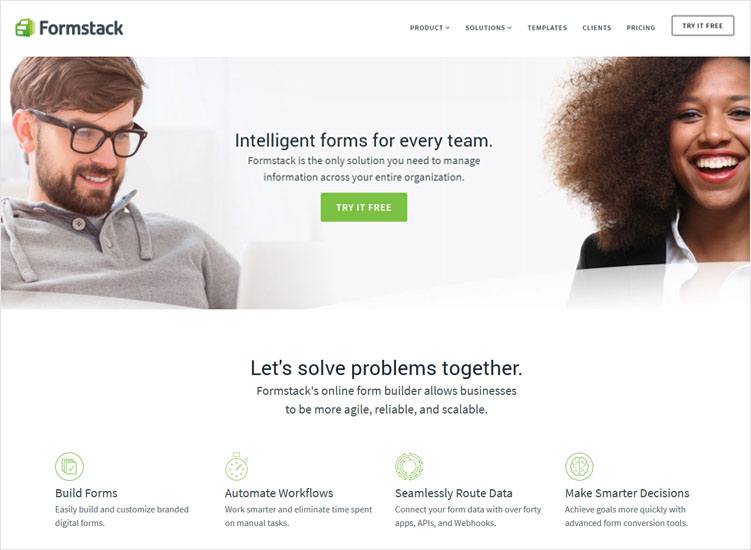
The height and width of the screenshot is (550, 751). Find the location of `makeup`. makeup is located at coordinates (697, 104).